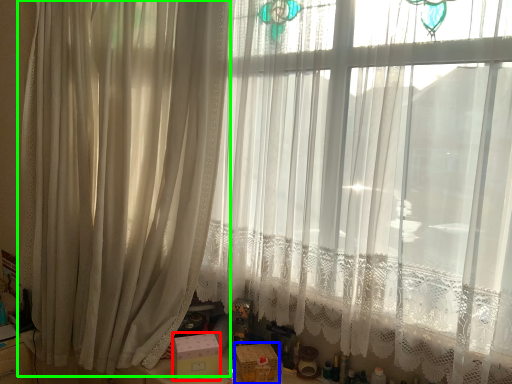
Question: Considering the real-world distances, which object is farthest from box (highlighted by a red box)? box (highlighted by a blue box) or curtain (highlighted by a green box)?

Choices:
 (A) box
 (B) curtain

Answer: (B)